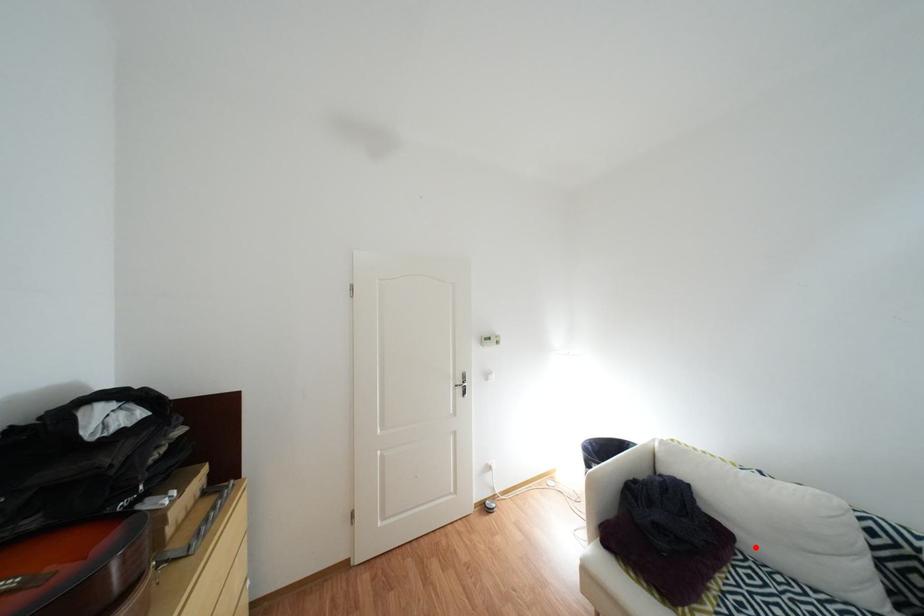
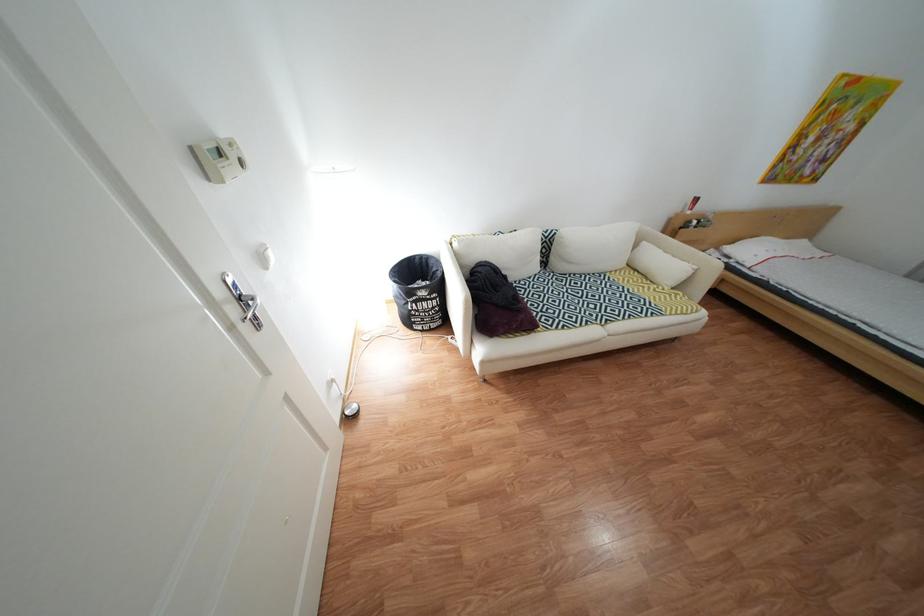
Question: I am providing you with two images of the same scene from different viewpoints. Image1 has a red point marked. In image2, the corresponding 3D location appears at what relative position? Reply with the corresponding letter.

Choices:
 (A) Closer
 (B) Farther

Answer: (B)